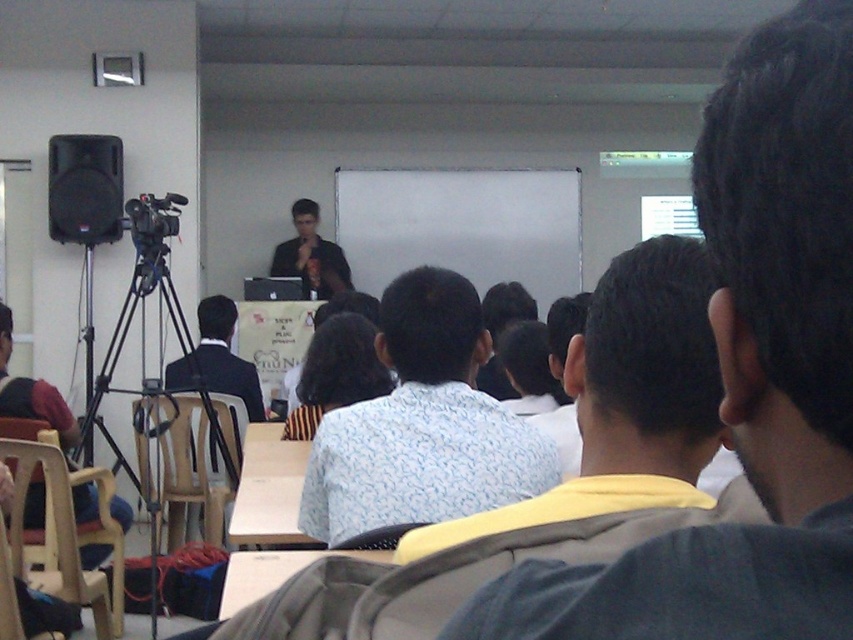
Question: Is light blue patterned shirt at center smaller than black matte tripod at left?

Choices:
 (A) yes
 (B) no

Answer: (A)

Question: Is light blue patterned shirt at center to the right of matte black shirt at center from the viewer's perspective?

Choices:
 (A) no
 (B) yes

Answer: (B)

Question: Which point is farther to the camera?

Choices:
 (A) matte black shirt at center
 (B) black matte speaker at left
 (C) light brown plastic chair at lower left
 (D) light blue patterned shirt at center

Answer: (A)

Question: Observing the image, what is the correct spatial positioning of black matte tripod at left in reference to matte black shirt at center?

Choices:
 (A) above
 (B) below

Answer: (B)

Question: Among these points, which one is farthest from the camera?

Choices:
 (A) (624, 412)
 (B) (117, 141)
 (C) (347, 272)
 (D) (50, 435)

Answer: (C)

Question: Which point is closer to the camera?

Choices:
 (A) (463, 481)
 (B) (48, 141)

Answer: (A)